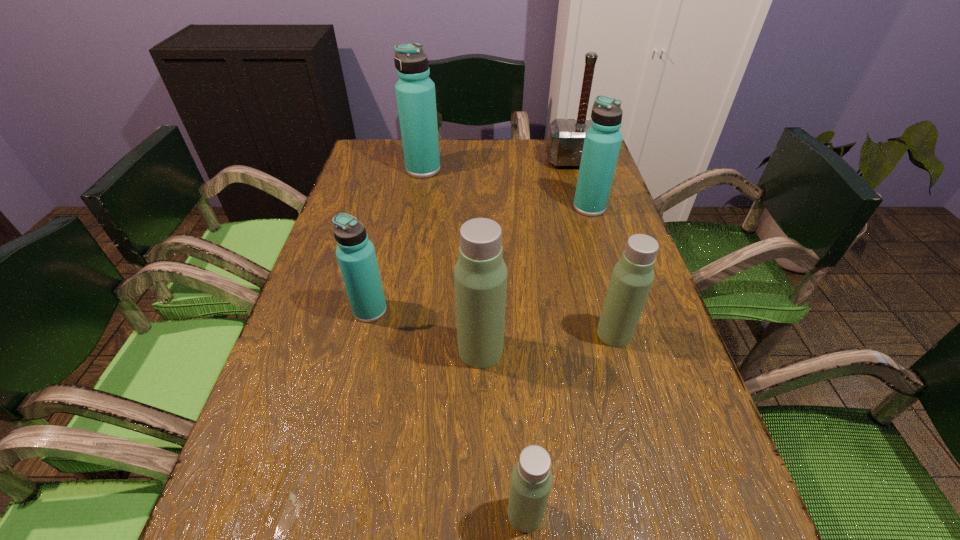
Image resolution: width=960 pixels, height=540 pixels. Identify the location of free space in the image that satisfies the following two spatial constraints: 1. on the back side of the rightmost light thermos bottle; 2. on the right side of the biggest light thermos bottle. (481, 334).